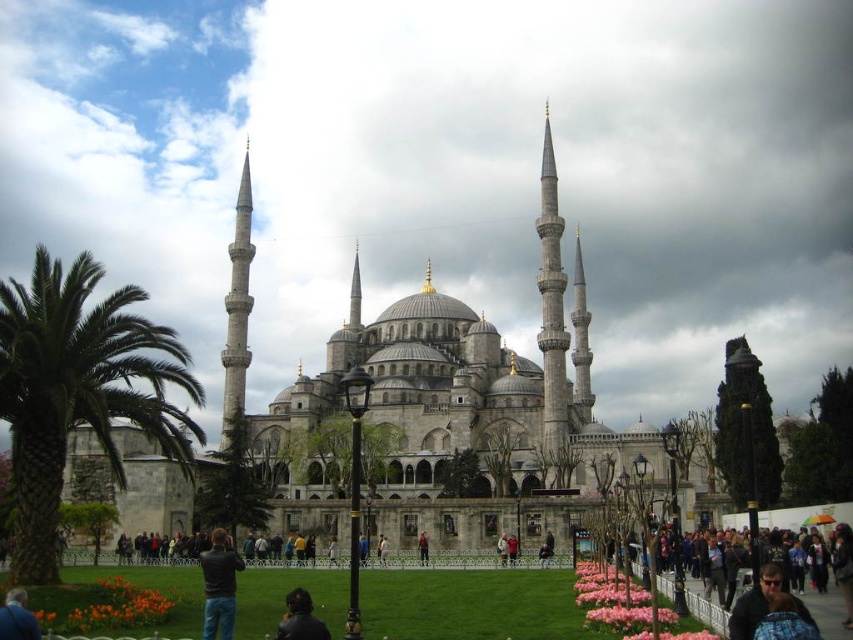
Question: Which point is farther from the camera taking this photo?

Choices:
 (A) (9, 637)
 (B) (425, 536)
 (C) (322, 636)

Answer: (B)

Question: Which point is farther to the camera?

Choices:
 (A) dark brown leather jacket at lower center
 (B) green leafy palm tree at left

Answer: (B)

Question: In this image, where is dark brown leather jacket at lower center located relative to dark blue jeans at center?

Choices:
 (A) left
 (B) right

Answer: (A)

Question: Which point is farther from the camera taking this photo?

Choices:
 (A) (6, 611)
 (B) (160, 328)

Answer: (B)

Question: Does dark brown leather jacket at lower center appear on the right side of dark blue jacket at lower left?

Choices:
 (A) yes
 (B) no

Answer: (A)

Question: Does green leafy palm tree at left come in front of dark brown leather jacket at lower center?

Choices:
 (A) no
 (B) yes

Answer: (A)